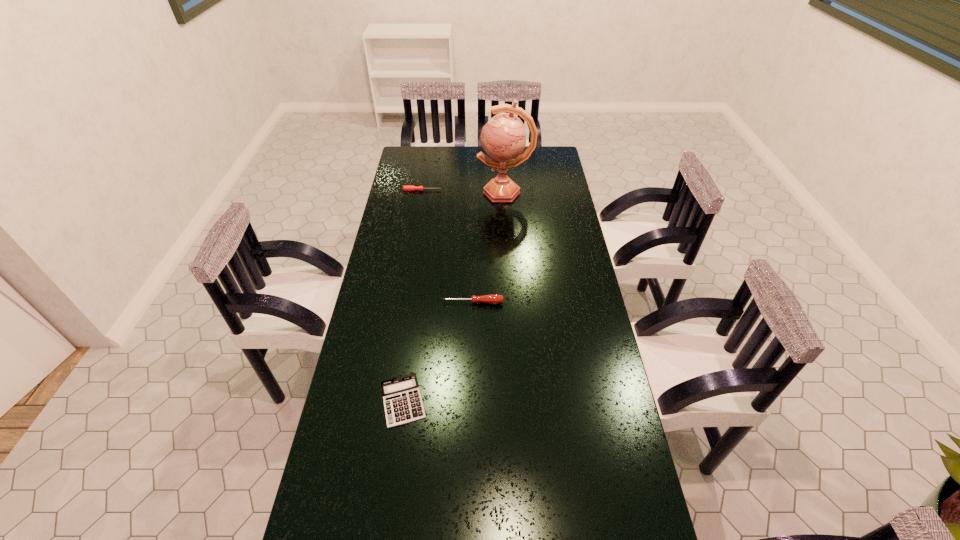
Identify the location of vacant area located 0.050m at the tip of the shorter screwdriver. [452, 190].

Where is `vacant space located 0.350m on the back of the calculator`? This screenshot has height=540, width=960. vacant space located 0.350m on the back of the calculator is located at coordinates (418, 293).

At what (x,y) coordinates should I click in order to perform the action: click on screwdriver at the left edge. Please return your answer as a coordinate pair (x, y). Looking at the image, I should click on (405, 188).

At what (x,y) coordinates should I click in order to perform the action: click on calculator that is at the left edge. Please return your answer as a coordinate pair (x, y). Looking at the image, I should click on (402, 400).

In the image, there is a desktop. Where is `vacant region at the far edge`? This screenshot has width=960, height=540. vacant region at the far edge is located at coordinates (450, 156).

What are the coordinates of `vacant area at the left edge of the desktop` in the screenshot? It's located at (390, 213).

Locate an element on the screen. free region at the right edge of the desktop is located at coordinates (565, 293).

Find the location of a particular element. The height and width of the screenshot is (540, 960). free location at the far right corner is located at coordinates (545, 160).

The image size is (960, 540). Find the location of `vacant point located between the farther screwdriver and the tallest object`. vacant point located between the farther screwdriver and the tallest object is located at coordinates (464, 191).

Where is `vacant region between the tallest object and the shorter screwdriver`? This screenshot has height=540, width=960. vacant region between the tallest object and the shorter screwdriver is located at coordinates (464, 191).